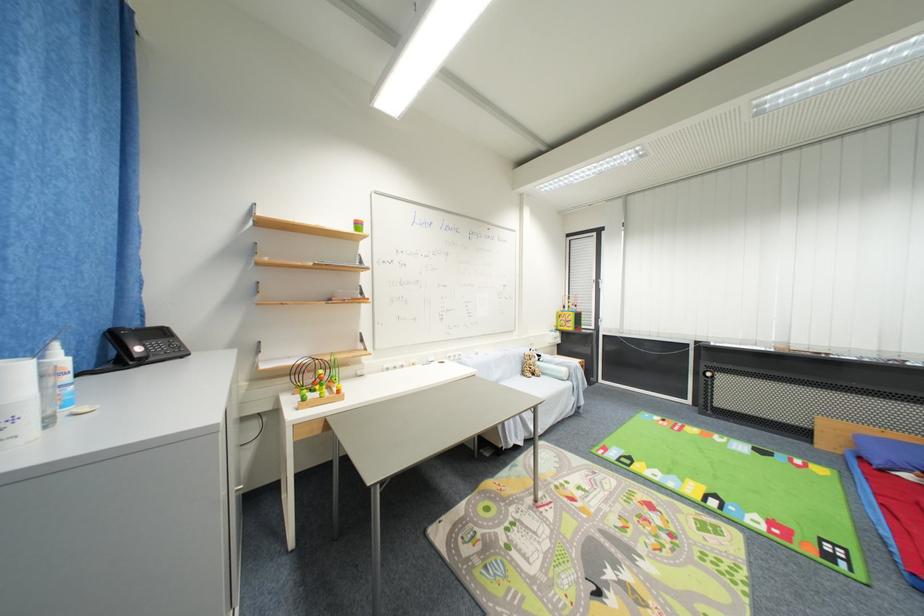
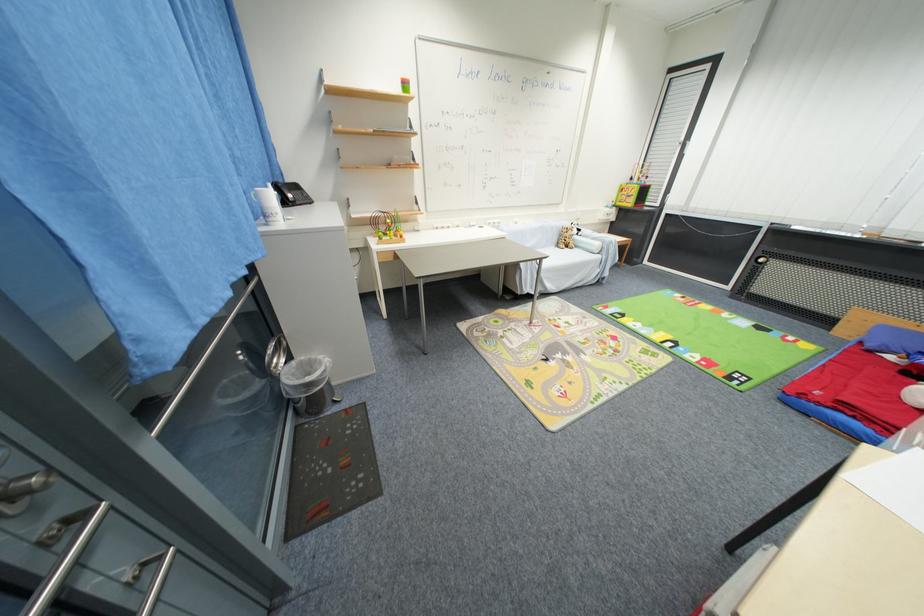
The point at (540, 379) is marked in the first image. Where is the corresponding point in the second image?

(572, 251)